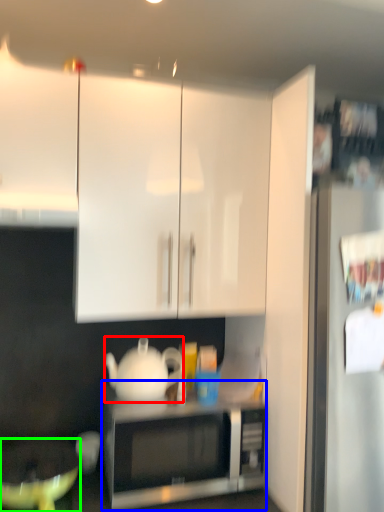
Question: Which object is positioned farthest from teapot (highlighted by a red box)? Select from microwave oven (highlighted by a blue box) and mixing bowl (highlighted by a green box).

Choices:
 (A) microwave oven
 (B) mixing bowl

Answer: (B)